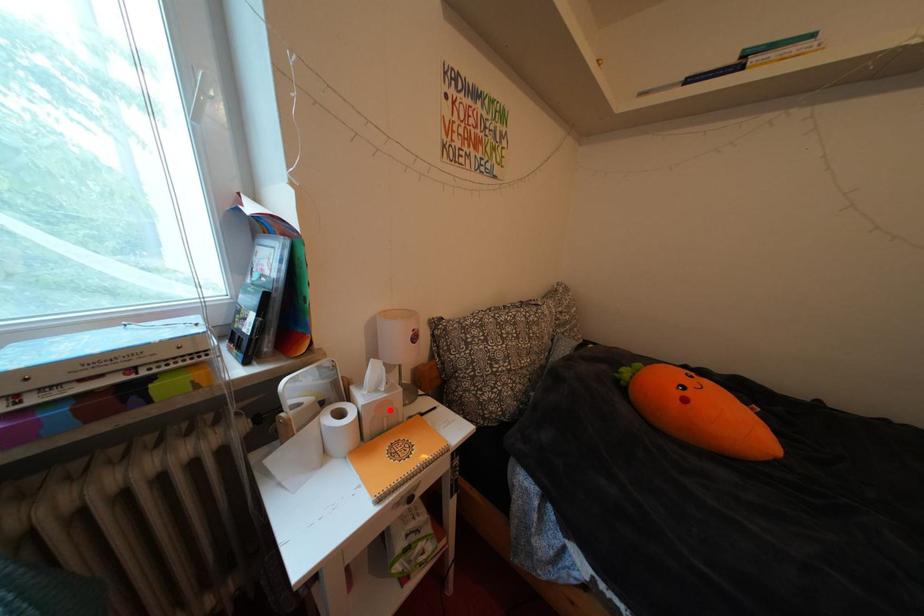
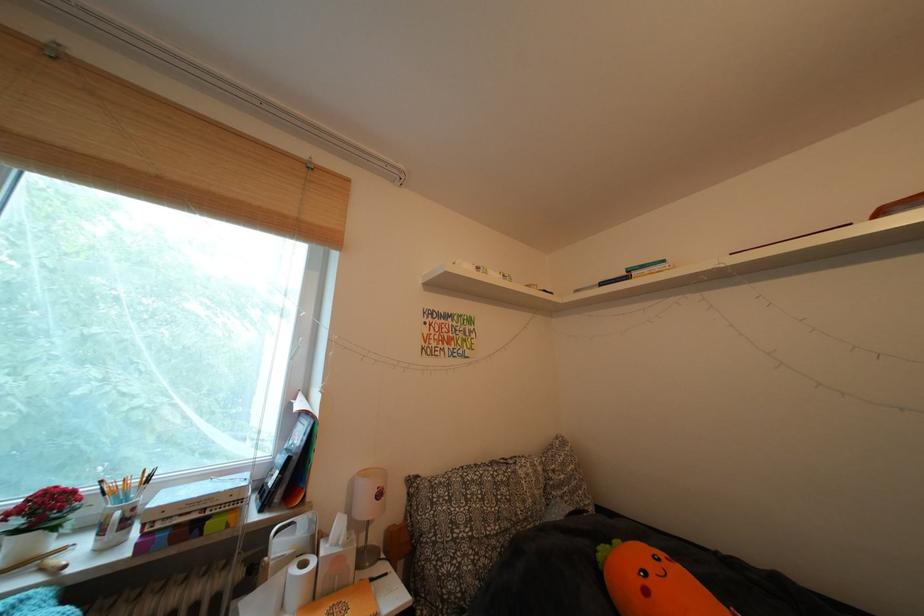
The point at the highlighted location is marked in the first image. Where is the corresponding point in the second image?

(346, 565)